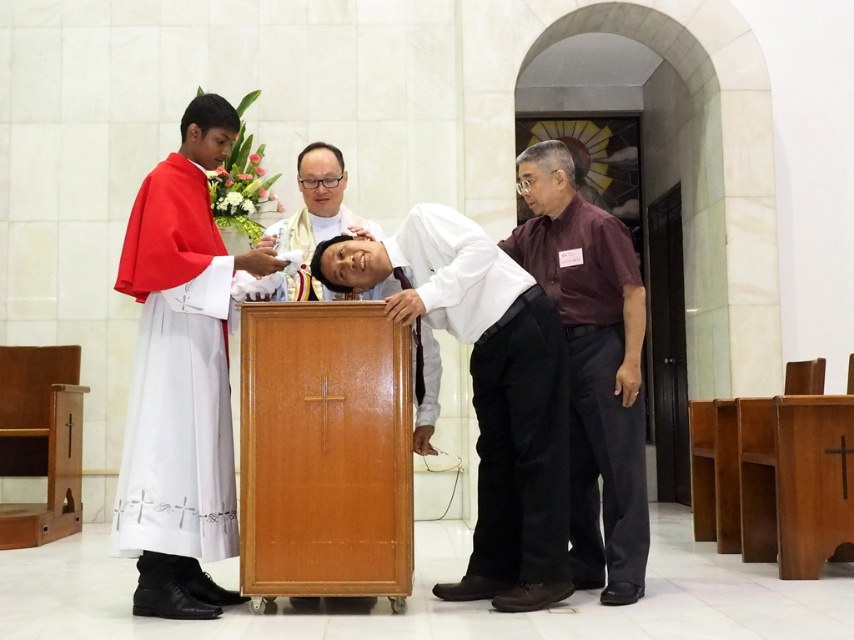
Question: Is matte red fabric at left further to camera compared to maroon shirt at right?

Choices:
 (A) no
 (B) yes

Answer: (A)

Question: Where is white matte/soft robe at center located in relation to white glossy wood lectern at center in the image?

Choices:
 (A) below
 (B) above

Answer: (A)

Question: Where is matte red fabric at left located in relation to white matte/soft robe at center in the image?

Choices:
 (A) below
 (B) above

Answer: (B)

Question: Estimate the real-world distances between objects in this image. Which object is farther from the matte red fabric at left?

Choices:
 (A) white matte/soft robe at center
 (B) white glossy wood lectern at center

Answer: (A)

Question: Which object is positioned farthest from the white matte/soft robe at center?

Choices:
 (A) maroon shirt at right
 (B) matte red fabric at left

Answer: (B)

Question: Which of these objects is positioned farthest from the matte red fabric at left?

Choices:
 (A) white glossy wood lectern at center
 (B) maroon shirt at right
 (C) white matte/soft robe at center

Answer: (B)